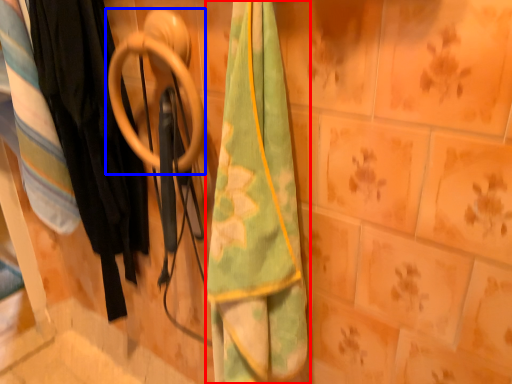
Question: Which object is further to the camera taking this photo, towel (highlighted by a red box) or door handle (highlighted by a blue box)?

Choices:
 (A) towel
 (B) door handle

Answer: (B)